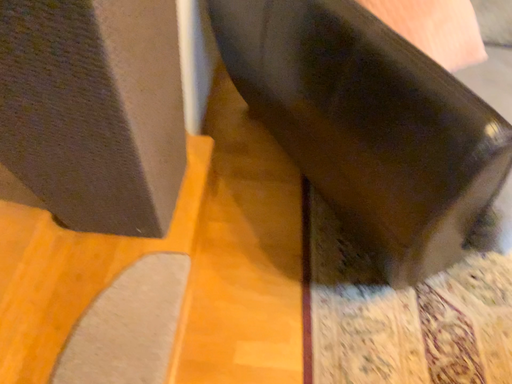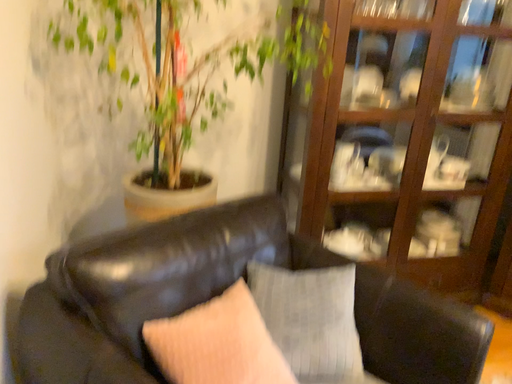
Question: How did the camera likely rotate when shooting the video?

Choices:
 (A) rotated upward
 (B) rotated downward

Answer: (A)